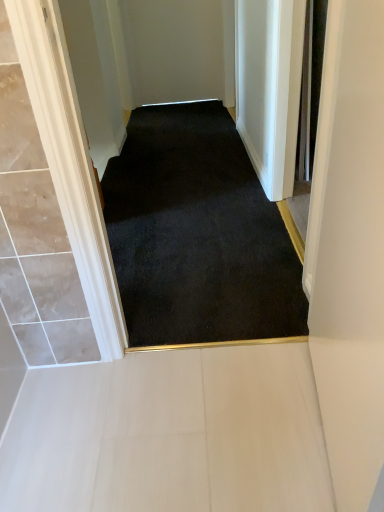
Identify the location of blank space to the left of matte white door at right. The image size is (384, 512). (213, 437).